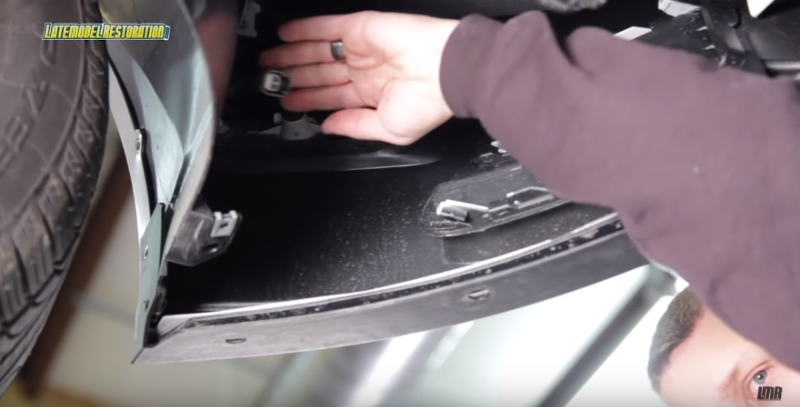
Image resolution: width=800 pixels, height=407 pixels. What are the coordinates of `ceiling background` in the screenshot? It's located at (490, 357).